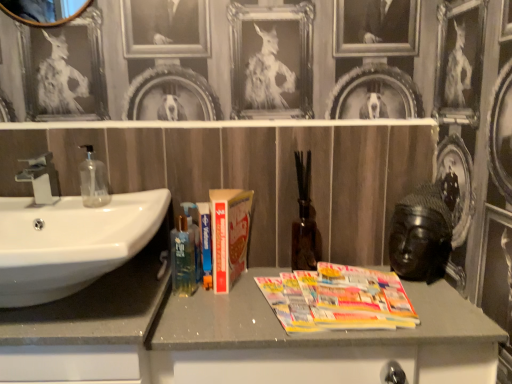
Question: Is transparent glass soap dispenser at left at the back of wooden mirror at upper left?

Choices:
 (A) yes
 (B) no

Answer: (B)

Question: Does wooden mirror at upper left have a lesser width compared to transparent glass soap dispenser at left?

Choices:
 (A) no
 (B) yes

Answer: (B)

Question: Is wooden mirror at upper left behind transparent glass soap dispenser at left?

Choices:
 (A) no
 (B) yes

Answer: (A)

Question: Can you confirm if wooden mirror at upper left is positioned to the right of transparent glass soap dispenser at left?

Choices:
 (A) no
 (B) yes

Answer: (A)

Question: Could you tell me if wooden mirror at upper left is facing transparent glass soap dispenser at left?

Choices:
 (A) yes
 (B) no

Answer: (B)

Question: In terms of width, does wooden mirror at upper left look wider or thinner when compared to multicolored glossy magazines at center?

Choices:
 (A) wide
 (B) thin

Answer: (B)

Question: Does point (8, 13) appear closer or farther from the camera than point (350, 279)?

Choices:
 (A) farther
 (B) closer

Answer: (A)

Question: Considering the relative positions of wooden mirror at upper left and multicolored glossy magazines at center in the image provided, is wooden mirror at upper left to the left or to the right of multicolored glossy magazines at center?

Choices:
 (A) left
 (B) right

Answer: (A)

Question: Looking at the image, does wooden mirror at upper left seem bigger or smaller compared to multicolored glossy magazines at center?

Choices:
 (A) small
 (B) big

Answer: (B)

Question: Does point (24, 218) appear closer or farther from the camera than point (81, 168)?

Choices:
 (A) closer
 (B) farther

Answer: (A)

Question: Relative to transparent glass soap dispenser at left, is white glossy sink at left in front or behind?

Choices:
 (A) front
 (B) behind

Answer: (A)

Question: From a real-world perspective, relative to transparent glass soap dispenser at left, is white glossy sink at left vertically above or below?

Choices:
 (A) above
 (B) below

Answer: (B)

Question: Choose the correct answer: Is white glossy sink at left inside transparent glass soap dispenser at left or outside it?

Choices:
 (A) inside
 (B) outside

Answer: (B)

Question: From a real-world perspective, is translucent plastic mouthwash at lower left positioned above or below matte silver faucet at left?

Choices:
 (A) below
 (B) above

Answer: (A)

Question: Would you say translucent plastic mouthwash at lower left is to the left or to the right of matte silver faucet at left in the picture?

Choices:
 (A) left
 (B) right

Answer: (B)